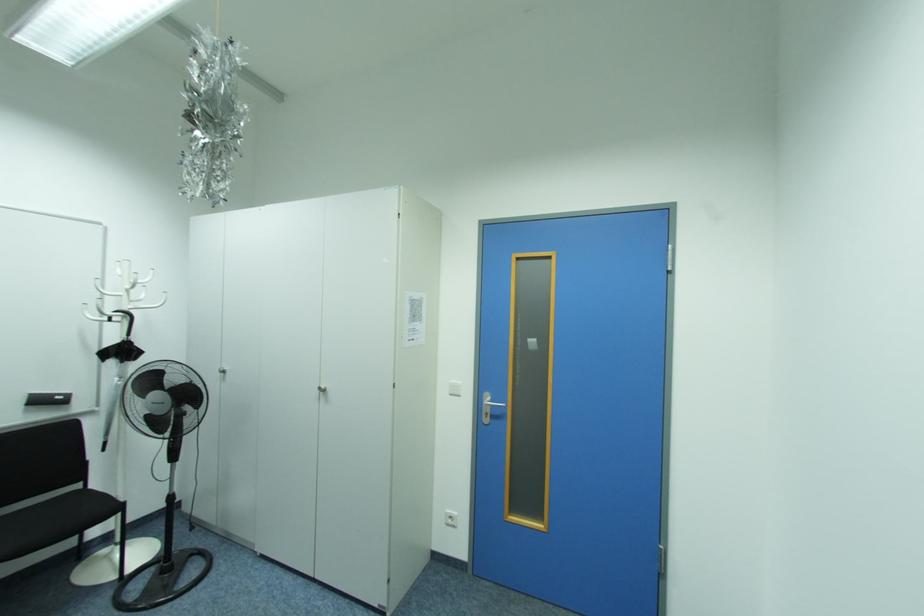
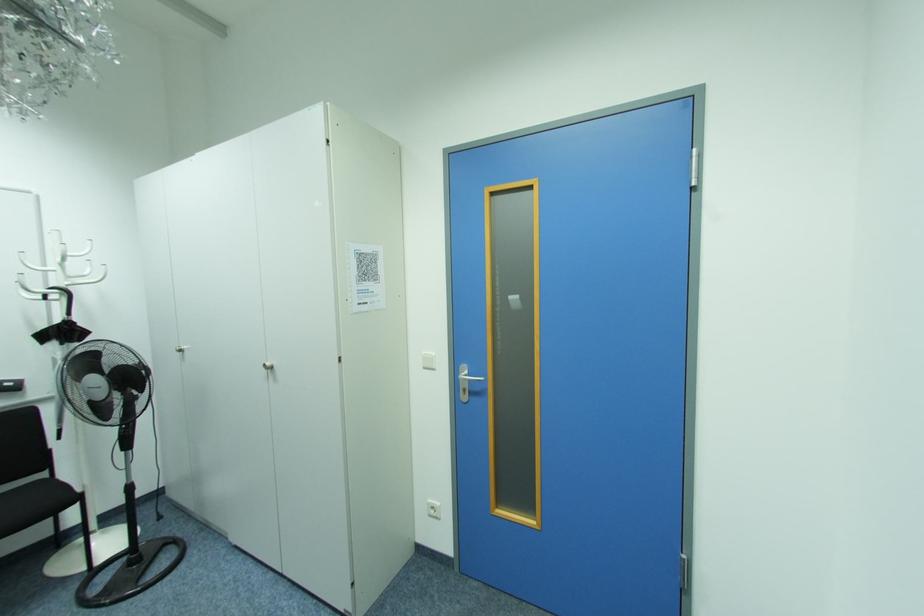
What movement of the cameraman would produce the second image?

The movement direction of the cameraman is right, forward.